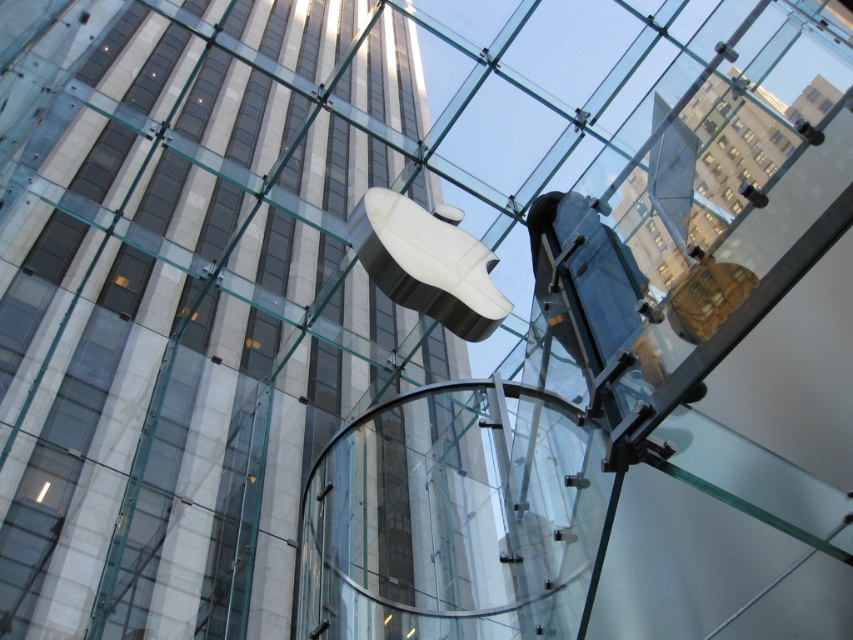
Does satin silver sculpture at center lie behind matte silver lamp at upper center?

Yes, satin silver sculpture at center is further from the viewer.

Where is `satin silver sculpture at center`? satin silver sculpture at center is located at coordinates (426, 262).

Between satin silver lamp at upper center and matte silver lamp at upper center, which one is positioned lower?

matte silver lamp at upper center

Is the position of satin silver lamp at upper center more distant than that of matte silver lamp at upper center?

No.

Between point (796, 125) and point (738, 188), which one is positioned in front?

Point (796, 125)

I want to click on satin silver lamp at upper center, so click(808, 131).

Measure the distance between satin silver sculpture at center and camera.

satin silver sculpture at center and camera are 6.00 meters apart from each other.

At what (x,y) coordinates should I click in order to perform the action: click on satin silver sculpture at center. Please return your answer as a coordinate pair (x, y). Looking at the image, I should click on (426, 262).